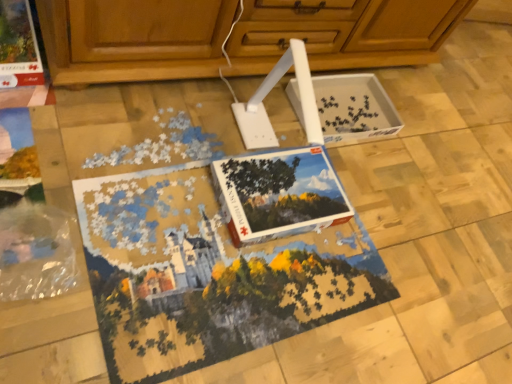
This screenshot has height=384, width=512. Identify the location of free point above white cardboard puzzle box at center, the 2th magazine from the top (from a real-world perspective). (267, 181).